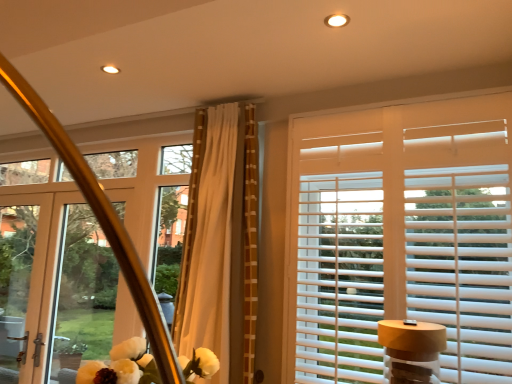
Find the location of `white wood blinds at upper right`. white wood blinds at upper right is located at coordinates (404, 236).

The width and height of the screenshot is (512, 384). What are the coordinates of `white wood blinds at upper right` in the screenshot? It's located at coord(404,236).

From a real-world perspective, relative to white wood blinds at upper right, is beige textured curtain at center vertically above or below?

In terms of real-world spatial position, beige textured curtain at center is above white wood blinds at upper right.

Is white wood blinds at upper right located within beige textured curtain at center?

No, white wood blinds at upper right is not surrounded by beige textured curtain at center.

Is there a large distance between beige textured curtain at center and white wood blinds at upper right?

No, beige textured curtain at center is not far from white wood blinds at upper right.

Is beige textured curtain at center in front of white wood blinds at upper right?

No, beige textured curtain at center is further to the viewer.

Does beige textured curtain at center turn towards matte white door at left?

No, beige textured curtain at center is not facing towards matte white door at left.

From the image's perspective, is beige textured curtain at center below matte white door at left?

No, from the image's perspective, beige textured curtain at center is not beneath matte white door at left.

Considering the sizes of objects beige textured curtain at center and matte white door at left in the image provided, who is wider, beige textured curtain at center or matte white door at left?

With larger width is beige textured curtain at center.

Which object is more forward, beige textured curtain at center or matte white door at left?

beige textured curtain at center is closer to the camera.

From a real-world perspective, is white wood blinds at upper right under matte white door at left?

No, from a real-world perspective, white wood blinds at upper right is not under matte white door at left.

Is white wood blinds at upper right wider than matte white door at left?

Indeed, white wood blinds at upper right has a greater width compared to matte white door at left.

This screenshot has height=384, width=512. I want to click on door that appears below the white wood blinds at upper right (from the image's perspective), so click(62, 290).

Considering the positions of objects white wood blinds at upper right and matte white door at left in the image provided, who is more to the right, white wood blinds at upper right or matte white door at left?

From the viewer's perspective, white wood blinds at upper right appears more on the right side.

Is beige textured curtain at center closer to the viewer compared to clear glass screen door at left?

Yes, the depth of beige textured curtain at center is less than that of clear glass screen door at left.

Is beige textured curtain at center facing towards clear glass screen door at left?

No, beige textured curtain at center does not turn towards clear glass screen door at left.

Does point (250, 277) come behind point (33, 212)?

No, (250, 277) is in front of (33, 212).

Considering their positions, is clear glass screen door at left located in front of or behind matte white door at left?

clear glass screen door at left is positioned farther from the viewer than matte white door at left.

Looking at this image, is clear glass screen door at left facing towards matte white door at left?

Yes, clear glass screen door at left is oriented towards matte white door at left.

From the image's perspective, between clear glass screen door at left and matte white door at left, who is located below?

clear glass screen door at left, from the image's perspective.

Does clear glass screen door at left touch matte white door at left?

No, clear glass screen door at left is not making contact with matte white door at left.

Which object is positioned more to the left, matte white door at left or beige textured curtain at center?

From the viewer's perspective, matte white door at left appears more on the left side.

Locate an element on the screen. door behind the beige textured curtain at center is located at coordinates (62, 290).

Is matte white door at left positioned beyond the bounds of beige textured curtain at center?

Yes.

Measure the distance between matte white door at left and beige textured curtain at center.

matte white door at left is 6.93 feet from beige textured curtain at center.

Does white wood blinds at upper right touch beige textured curtain at center?

There is a gap between white wood blinds at upper right and beige textured curtain at center.

From the image's perspective, is white wood blinds at upper right above or below beige textured curtain at center?

From the image's perspective, white wood blinds at upper right appears below beige textured curtain at center.

Considering the points (351, 382) and (246, 320), which point is in front, point (351, 382) or point (246, 320)?

The point (351, 382) is closer.

Measure the distance between white wood blinds at upper right and beige textured curtain at center.

A distance of 20.96 inches exists between white wood blinds at upper right and beige textured curtain at center.

In order to click on window blind on the right of beige textured curtain at center in this screenshot , I will do `click(404, 236)`.

This screenshot has width=512, height=384. Find the location of `door behind the beige textured curtain at center`. door behind the beige textured curtain at center is located at coordinates (62, 290).

Based on their spatial positions, is white wood blinds at upper right or matte white door at left further from beige textured curtain at center?

matte white door at left lies further to beige textured curtain at center than the other object.

Looking at the image, which one is located further to matte white door at left, clear glass screen door at left or white wood blinds at upper right?

The object further to matte white door at left is white wood blinds at upper right.

Estimate the real-world distances between objects in this image. Which object is further from beige textured curtain at center, matte white door at left or clear glass screen door at left?

clear glass screen door at left is further to beige textured curtain at center.

Which object lies further to the anchor point beige textured curtain at center, white wood blinds at upper right or clear glass screen door at left?

The object further to beige textured curtain at center is clear glass screen door at left.

From the image, which object appears to be nearer to white wood blinds at upper right, clear glass screen door at left or beige textured curtain at center?

beige textured curtain at center is positioned closer to the anchor white wood blinds at upper right.

Considering their positions, is clear glass screen door at left positioned further to beige textured curtain at center than white wood blinds at upper right?

clear glass screen door at left lies further to beige textured curtain at center than the other object.

Which object lies further to the anchor point clear glass screen door at left, matte white door at left or beige textured curtain at center?

beige textured curtain at center.

When comparing their distances from beige textured curtain at center, does matte white door at left or white wood blinds at upper right seem further?

matte white door at left.

This screenshot has height=384, width=512. Identify the location of door between clear glass screen door at left and beige textured curtain at center. (62, 290).

The height and width of the screenshot is (384, 512). In order to click on door situated between clear glass screen door at left and white wood blinds at upper right from left to right in this screenshot , I will do (62, 290).

Identify the location of curtain situated between matte white door at left and white wood blinds at upper right from left to right. This screenshot has height=384, width=512. (224, 215).

Find the location of `curtain between clear glass screen door at left and white wood blinds at upper right in the horizontal direction`. curtain between clear glass screen door at left and white wood blinds at upper right in the horizontal direction is located at coordinates (224, 215).